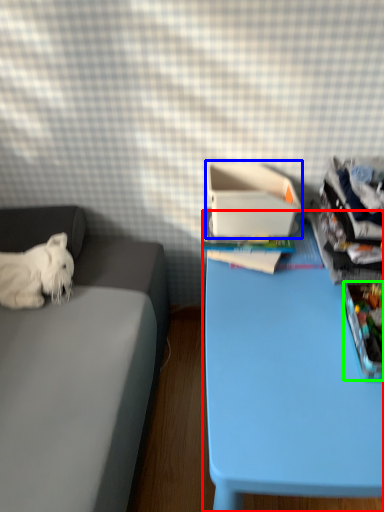
Question: Estimate the real-world distances between objects in this image. Which object is farther from table (highlighted by a red box), cardboard box (highlighted by a blue box) or storage box (highlighted by a green box)?

Choices:
 (A) cardboard box
 (B) storage box

Answer: (A)